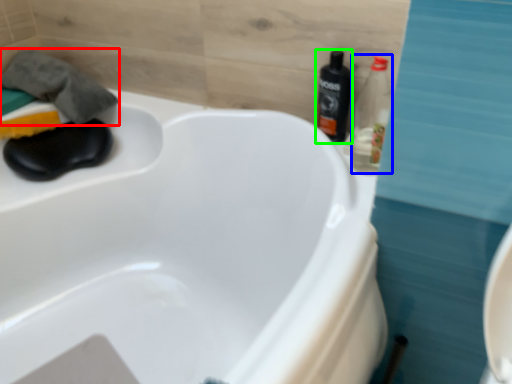
Question: Considering the real-world distances, which object is closest to bath towel (highlighted by a red box)? bottle (highlighted by a blue box) or bottle (highlighted by a green box).

Choices:
 (A) bottle
 (B) bottle

Answer: (B)